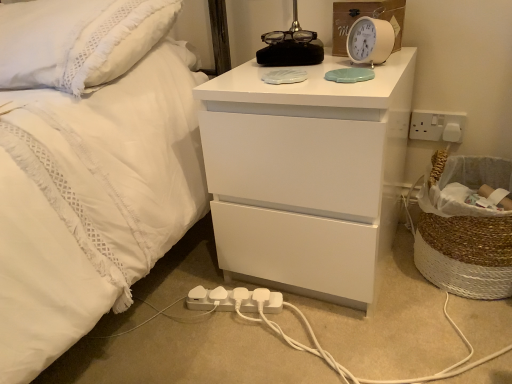
The image size is (512, 384). In order to click on free spot behind white plastic extension cord at lower center in this screenshot , I will do `click(197, 269)`.